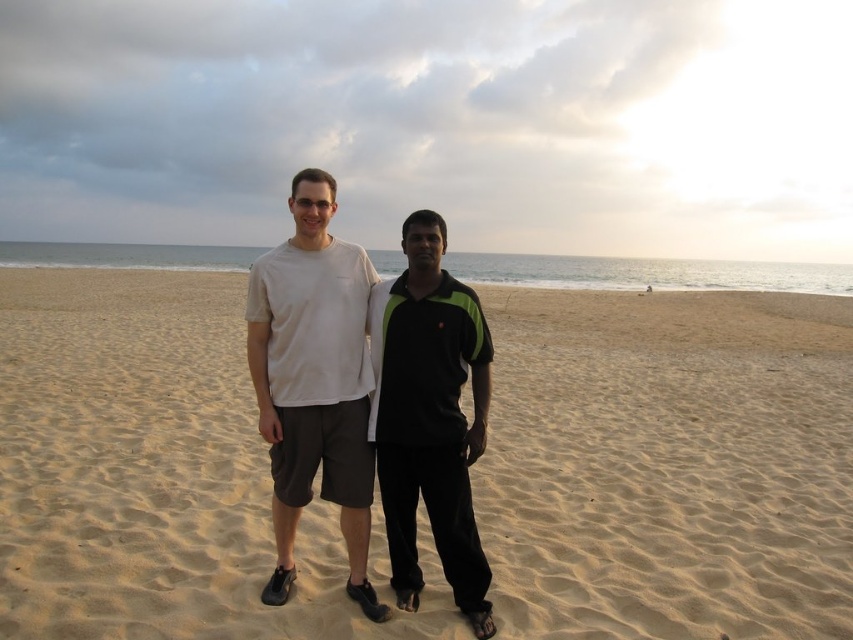
From the picture: Who is more distant from viewer, [325,525] or [305,307]?

Positioned behind is point [325,525].

Between sandy yellow sand at center and white matte t-shirt at center, which one has more height?

With more height is sandy yellow sand at center.

Between point (595, 570) and point (250, 321), which one is positioned behind?

The point (595, 570) is behind.

Locate an element on the screen. Image resolution: width=853 pixels, height=640 pixels. sandy yellow sand at center is located at coordinates (668, 465).

Which is below, white matte t-shirt at center or black matte shirt at center?

black matte shirt at center is lower down.

Can you confirm if white matte t-shirt at center is positioned to the right of black matte shirt at center?

Incorrect, white matte t-shirt at center is not on the right side of black matte shirt at center.

The height and width of the screenshot is (640, 853). I want to click on white matte t-shirt at center, so click(314, 381).

Between sandy yellow sand at center and black matte shirt at center, which one has more height?

With more height is sandy yellow sand at center.

Is sandy yellow sand at center positioned before black matte shirt at center?

No, sandy yellow sand at center is behind black matte shirt at center.

Does point (778, 428) come farther from viewer compared to point (465, 612)?

Yes, it is.

This screenshot has width=853, height=640. I want to click on sandy yellow sand at center, so click(x=668, y=465).